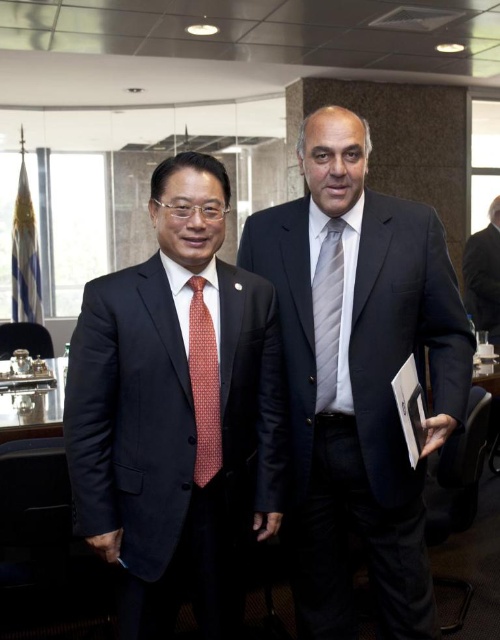
Who is lower down, red dotted tie at left or black suit at right?

Positioned lower is red dotted tie at left.

Between point (214, 461) and point (496, 232), which one is positioned in front?

Positioned in front is point (214, 461).

Identify the location of red dotted tie at left. (204, 385).

At what (x,y) coordinates should I click in order to perform the action: click on red dotted tie at left. Please return your answer as a coordinate pair (x, y). The image size is (500, 640). Looking at the image, I should click on (204, 385).

In the scene shown: Does gray striped tie at center have a greater height compared to black suit at right?

No.

Does gray striped tie at center have a lesser height compared to black suit at right?

Correct, gray striped tie at center is not as tall as black suit at right.

The image size is (500, 640). In order to click on gray striped tie at center in this screenshot , I will do `click(328, 312)`.

You are a GUI agent. You are given a task and a screenshot of the screen. Output one action in this format:
    pyautogui.click(x=<x>, y=<y>)
    Task: Click on the gray striped tie at center
    
    Given the screenshot: What is the action you would take?
    pyautogui.click(x=328, y=312)

Is point (148, 621) closer to camera compared to point (212, 416)?

That is False.

What do you see at coordinates (177, 412) in the screenshot? The width and height of the screenshot is (500, 640). I see `matte black suit at center` at bounding box center [177, 412].

The image size is (500, 640). Find the location of `matte black suit at center`. matte black suit at center is located at coordinates (177, 412).